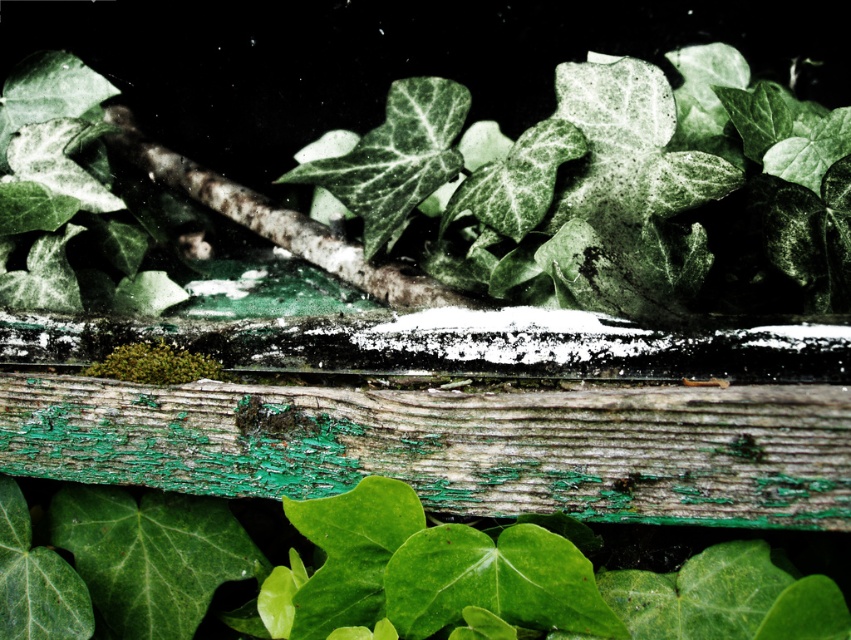
Question: Which of the following is the farthest from the observer?

Choices:
 (A) (67, 438)
 (B) (546, 241)

Answer: (B)

Question: Can you confirm if peeling green paint wood plank at center is bigger than green matte leaves at center?

Choices:
 (A) no
 (B) yes

Answer: (A)

Question: Among these objects, which one is farthest from the camera?

Choices:
 (A) peeling green paint wood plank at center
 (B) green matte leaves at center

Answer: (B)

Question: Which point is closer to the camera?

Choices:
 (A) peeling green paint wood plank at center
 (B) green matte leaves at center

Answer: (A)

Question: Does peeling green paint wood plank at center appear under green matte leaves at center?

Choices:
 (A) yes
 (B) no

Answer: (A)

Question: Is the position of peeling green paint wood plank at center more distant than that of green matte leaves at center?

Choices:
 (A) yes
 (B) no

Answer: (B)